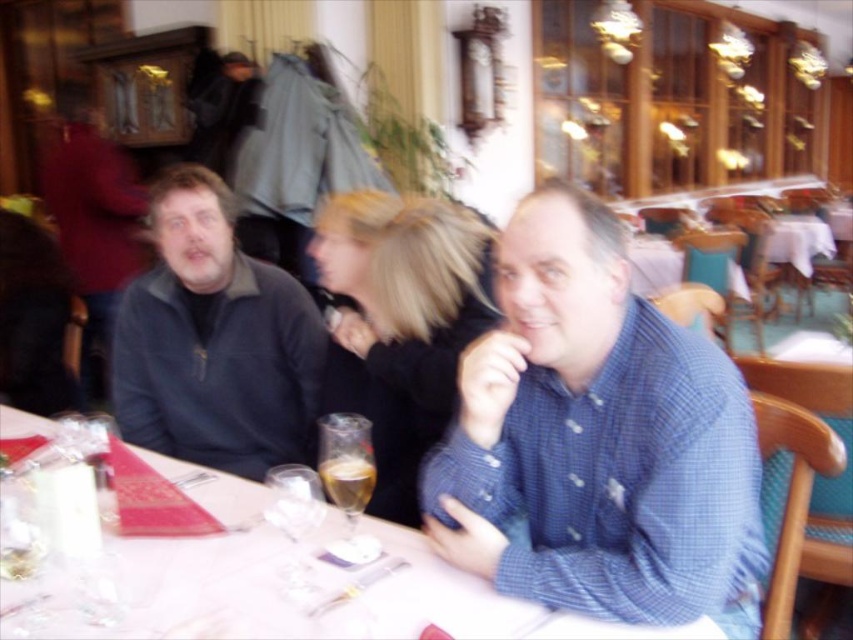
Looking at this image, between blonde hair at center and clear glass wine at center, which one is positioned lower?

clear glass wine at center

Does point (375, 348) come behind point (357, 474)?

Yes, point (375, 348) is behind point (357, 474).

Which is in front, point (444, 275) or point (357, 500)?

Point (357, 500)

You are a GUI agent. You are given a task and a screenshot of the screen. Output one action in this format:
    pyautogui.click(x=<x>, y=<y>)
    Task: Click on the blonde hair at center
    This screenshot has height=640, width=853.
    Given the screenshot: What is the action you would take?
    tap(401, 321)

The width and height of the screenshot is (853, 640). In order to click on blonde hair at center in this screenshot , I will do `click(401, 321)`.

Which is behind, point (383, 378) or point (358, 500)?

Positioned behind is point (383, 378).

Which is in front, point (386, 449) or point (347, 468)?

Point (347, 468) is more forward.

Identify the location of blonde hair at center. (401, 321).

Does point (438, 531) come farther from viewer compared to point (392, 636)?

Yes, it is.

Can you confirm if blue checkered shirt at center is bigger than white glossy table at center?

Yes, blue checkered shirt at center is bigger than white glossy table at center.

Is point (607, 500) in front of point (442, 572)?

Yes, point (607, 500) is closer to viewer.

Where is `blue checkered shirt at center`? blue checkered shirt at center is located at coordinates (596, 438).